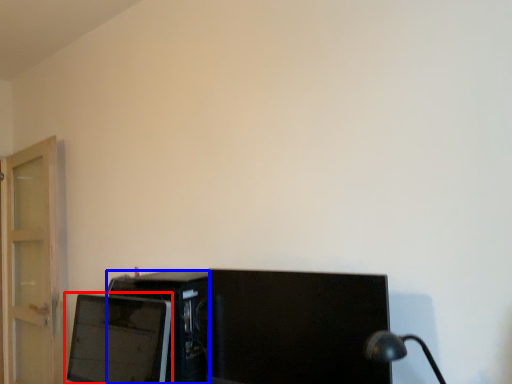
Question: Among these objects, which one is farthest to the camera, computer monitor (highlighted by a red box) or desktop computer (highlighted by a blue box)?

Choices:
 (A) computer monitor
 (B) desktop computer

Answer: (B)